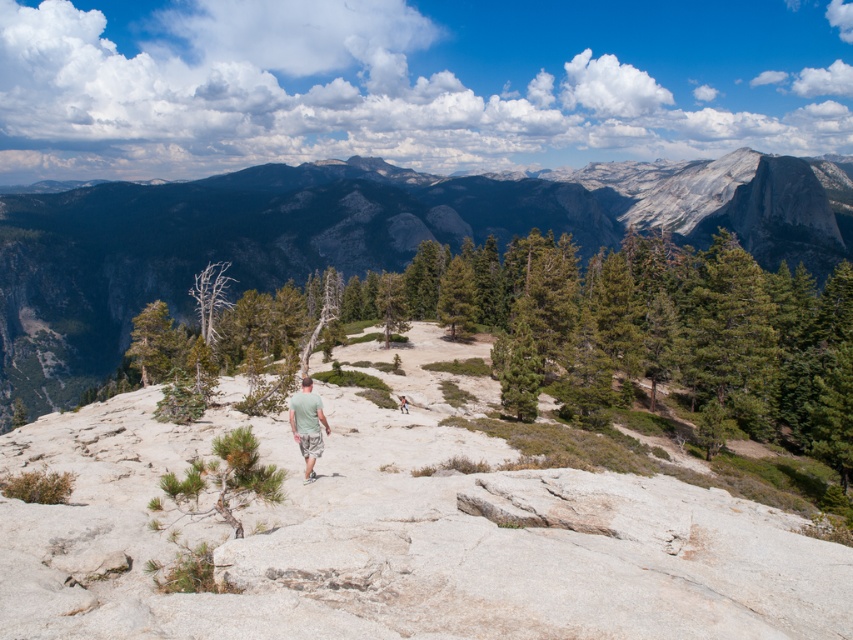
You are a photographer planning to take a landscape photo that includes both the gray rock formation at center and the green fabric shirt at center. Which object should you focus on first if you want to ensure both are in sharp focus?

The gray rock formation at center has a greater height compared to the green fabric shirt at center, so you should focus on the gray rock formation at center first to ensure both are in sharp focus.

You are a photographer planning to capture a wide landscape shot that includes both the gray rock formation at center and the green fabric shirt at center. Considering their sizes, which object should you focus on first to ensure both are clearly visible in the frame?

The gray rock formation at center is bigger than the green fabric shirt at center, so you should focus on the gray rock formation at center first to ensure both are clearly visible in the frame.